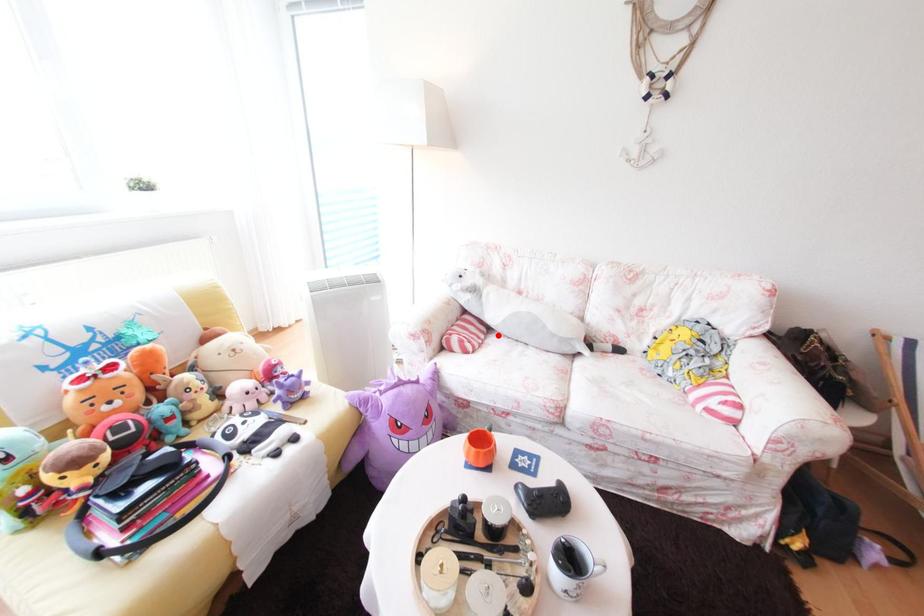
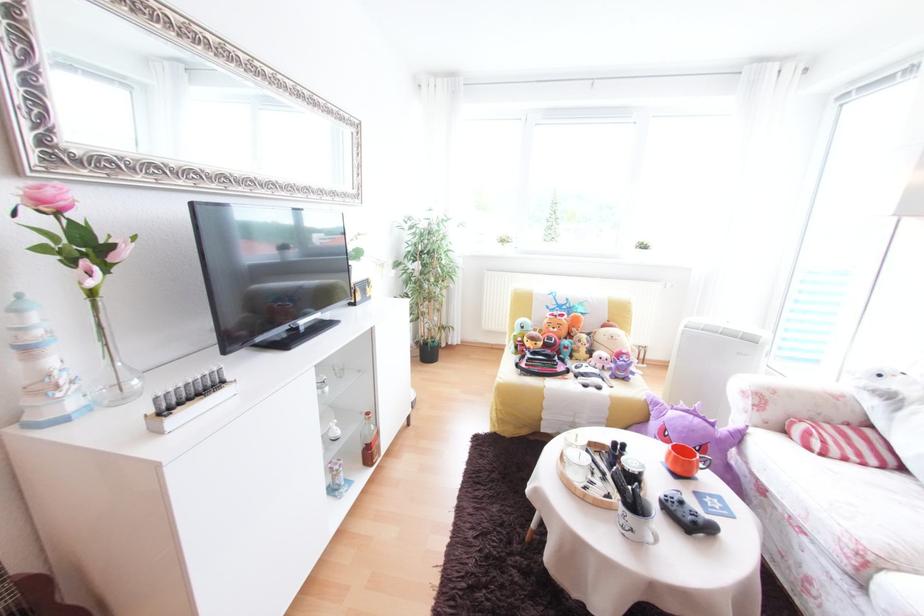
Question: I am providing you with two images of the same scene from different viewpoints. Given a red point in image1, look at the same physical point in image2. Is it:

Choices:
 (A) Closer to the viewpoint
 (B) Farther from the viewpoint

Answer: (B)